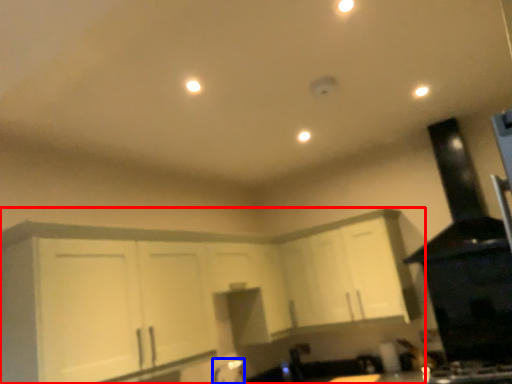
Question: Among these objects, which one is farthest to the camera, cabinetry (highlighted by a red box) or faucet (highlighted by a blue box)?

Choices:
 (A) cabinetry
 (B) faucet

Answer: (B)